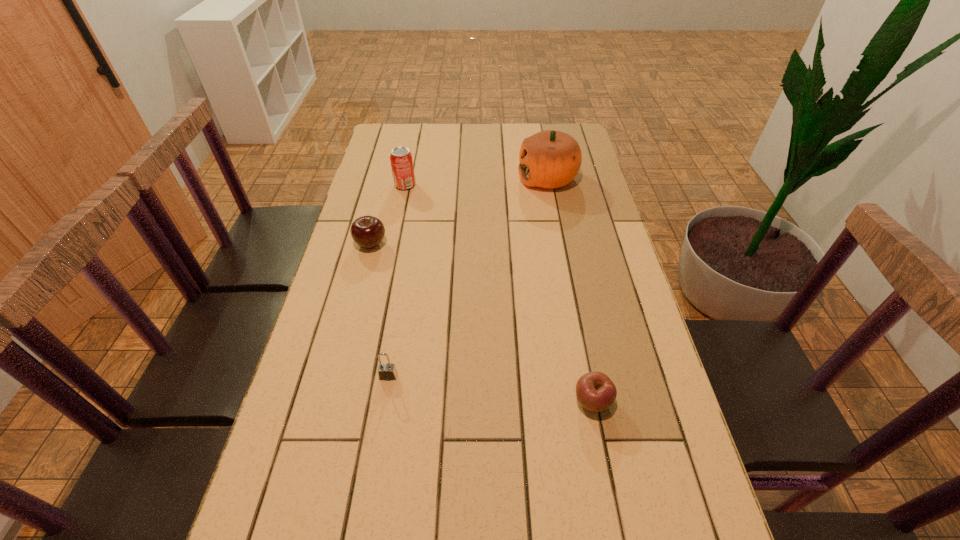
The image size is (960, 540). Identify the location of unoccupied position between the pumpkin and the shorter apple. (570, 290).

This screenshot has width=960, height=540. I want to click on blank region between the padlock and the nearest object, so [x=491, y=389].

Identify the location of vacant space in between the second nearest object and the farther apple. The height and width of the screenshot is (540, 960). (379, 310).

The height and width of the screenshot is (540, 960). Find the location of `empty space that is in between the shortest object and the tallest object`. empty space that is in between the shortest object and the tallest object is located at coordinates (570, 290).

You are a GUI agent. You are given a task and a screenshot of the screen. Output one action in this format:
    pyautogui.click(x=<x>, y=<y>)
    Task: Click on the vacant space that is in between the soda can and the pumpkin
    
    Given the screenshot: What is the action you would take?
    pyautogui.click(x=476, y=181)

Where is `free space between the shortest object and the soda can`? free space between the shortest object and the soda can is located at coordinates (499, 293).

Locate an element on the screen. This screenshot has width=960, height=540. free space between the shortest object and the taller apple is located at coordinates (482, 323).

Image resolution: width=960 pixels, height=540 pixels. What are the coordinates of `free space that is in between the taller apple and the padlock` in the screenshot? It's located at (379, 310).

Find the location of a particular element. The image size is (960, 540). free space between the soda can and the shortest object is located at coordinates (499, 293).

What are the coordinates of `free space between the left apple and the tallest object` in the screenshot? It's located at (459, 211).